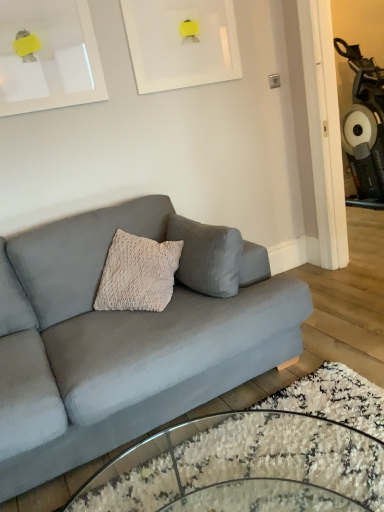
Question: From the image's perspective, is white matte picture frame at upper center, the second picture frame positioned from the left, located above or below clear glass coffee table at lower center?

Choices:
 (A) above
 (B) below

Answer: (A)

Question: Based on their sizes in the image, would you say white matte picture frame at upper center, the 1th picture frame positioned from the right, is bigger or smaller than clear glass coffee table at lower center?

Choices:
 (A) big
 (B) small

Answer: (B)

Question: Which is nearer to the white matte picture frame at upper center, the 2th picture frame from the right?

Choices:
 (A) white matte picture frame at upper center, the 1th picture frame positioned from the right
 (B) clear glass coffee table at lower center
 (C) matte gray couch at center

Answer: (A)

Question: Estimate the real-world distances between objects in this image. Which object is farther from the clear glass coffee table at lower center?

Choices:
 (A) matte gray couch at center
 (B) white matte picture frame at upper center, the 2th picture frame from the right
 (C) white matte picture frame at upper center, the second picture frame positioned from the left

Answer: (C)